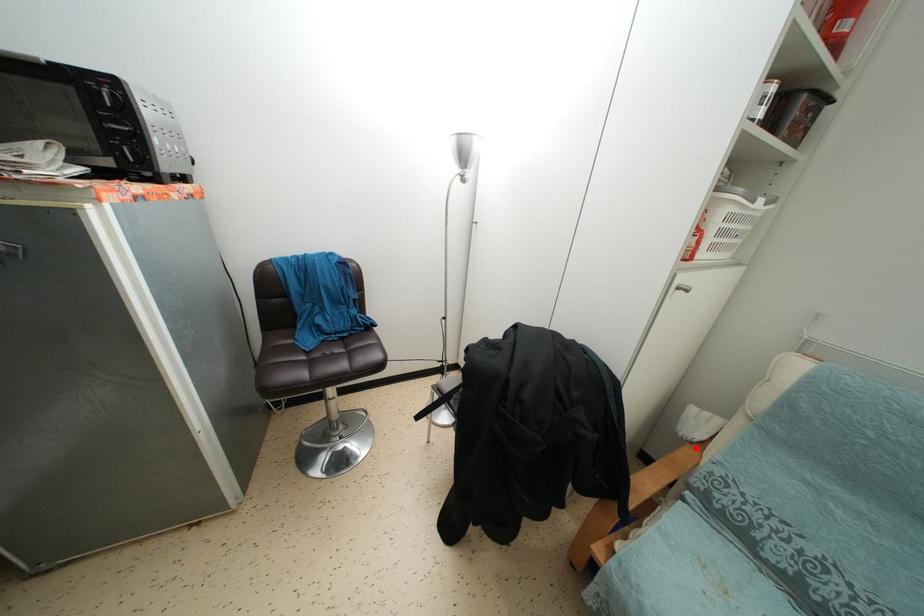
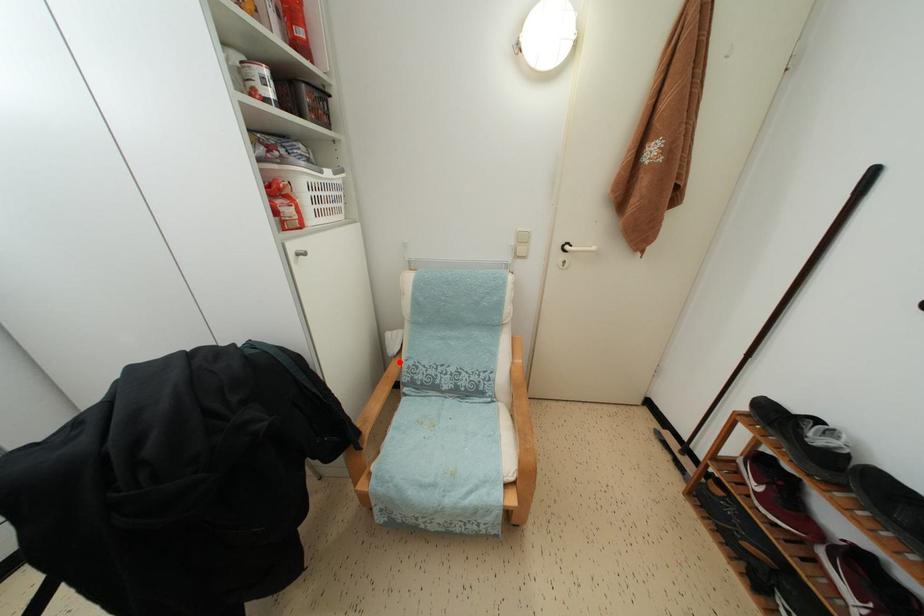
I am providing you with two images of the same scene from different viewpoints. A red point is marked on the first image and another point is marked on the second image. Is the marked point in image1 the same physical position as the marked point in image2?

Yes